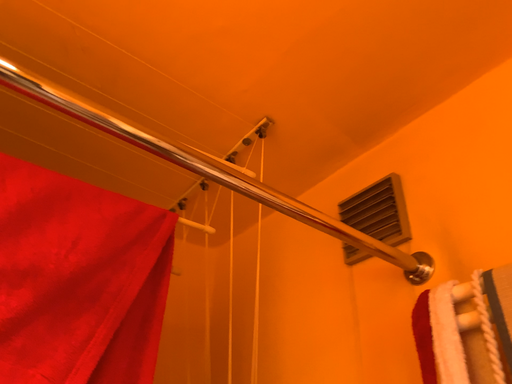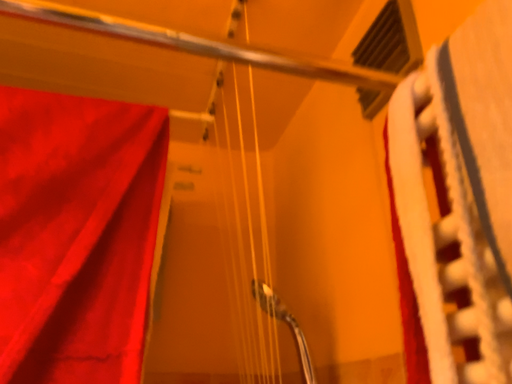
Question: Which way did the camera rotate in the video?

Choices:
 (A) rotated right
 (B) rotated left

Answer: (B)